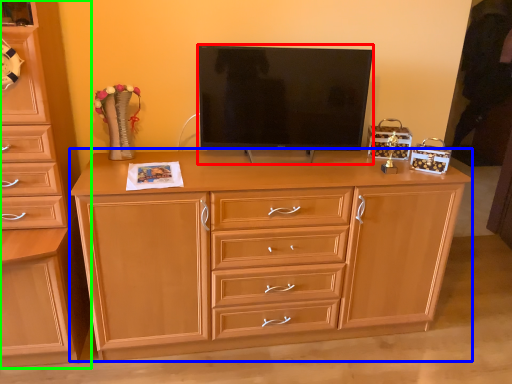
Question: Based on their relative distances, which object is nearer to television (highlighted by a red box)? Choose from chest of drawers (highlighted by a blue box) and chest of drawers (highlighted by a green box).

Choices:
 (A) chest of drawers
 (B) chest of drawers

Answer: (A)